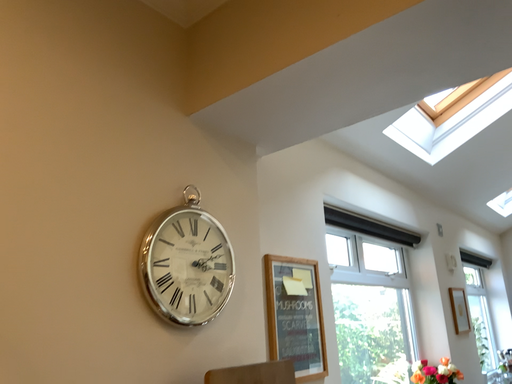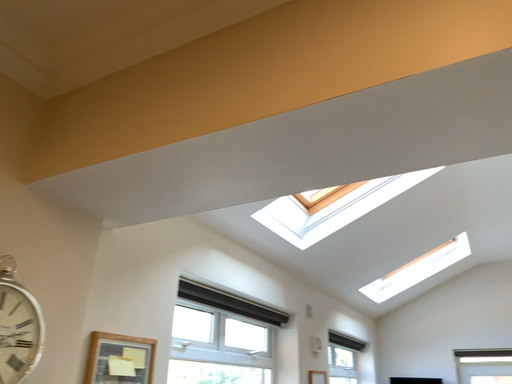
Question: Which way did the camera rotate in the video?

Choices:
 (A) rotated right
 (B) rotated left

Answer: (A)